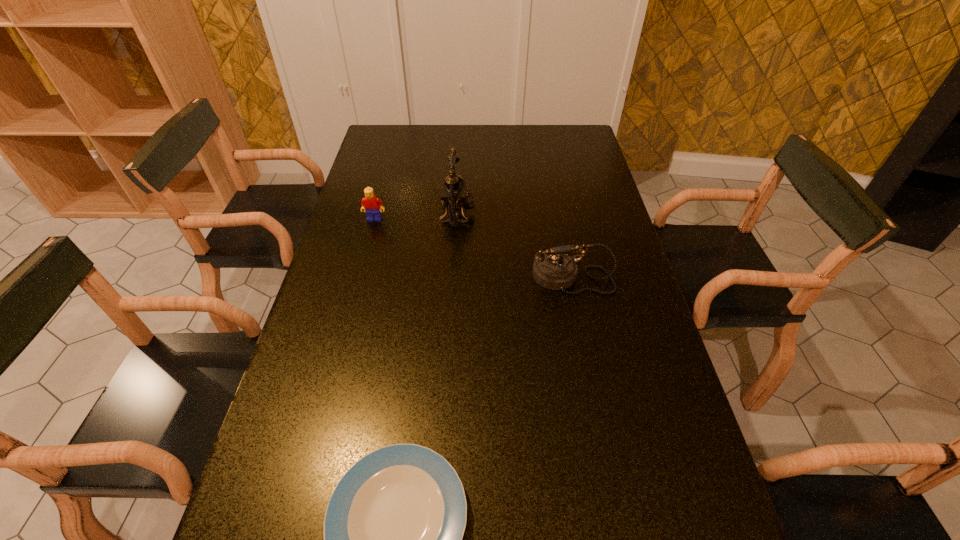
Identify the location of vacant area that satisfies the following two spatial constraints: 1. on the rotary dial of the third farthest object; 2. on the left side of the taller telephone. The height and width of the screenshot is (540, 960). (454, 277).

Where is `vacant space that satisfies the following two spatial constraints: 1. on the face of the Lego; 2. on the right side of the nearer telephone`? The width and height of the screenshot is (960, 540). vacant space that satisfies the following two spatial constraints: 1. on the face of the Lego; 2. on the right side of the nearer telephone is located at coordinates (360, 277).

The width and height of the screenshot is (960, 540). I want to click on vacant space that satisfies the following two spatial constraints: 1. on the face of the Lego; 2. on the left side of the right telephone, so click(x=360, y=277).

This screenshot has height=540, width=960. Identify the location of vacant space that satisfies the following two spatial constraints: 1. on the rotary dial of the left telephone; 2. on the face of the Lego. (457, 219).

Image resolution: width=960 pixels, height=540 pixels. What are the coordinates of `free spot that satisfies the following two spatial constraints: 1. on the face of the nearer telephone; 2. on the left side of the leftmost object` in the screenshot? It's located at (360, 277).

The height and width of the screenshot is (540, 960). I want to click on free region that satisfies the following two spatial constraints: 1. on the rotary dial of the farther telephone; 2. on the left side of the shorter telephone, so click(454, 277).

Image resolution: width=960 pixels, height=540 pixels. I want to click on vacant region that satisfies the following two spatial constraints: 1. on the rotary dial of the nearer telephone; 2. on the left side of the taller telephone, so click(454, 277).